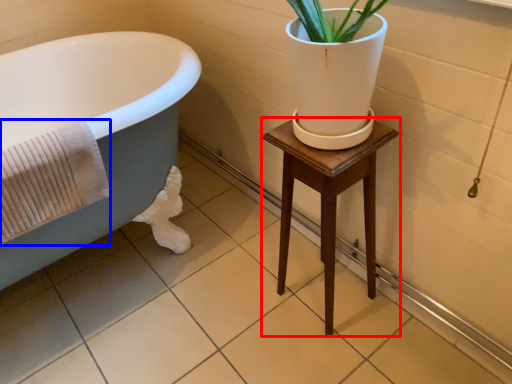
Question: Which object is closer to the camera taking this photo, furniture (highlighted by a red box) or bath towel (highlighted by a blue box)?

Choices:
 (A) furniture
 (B) bath towel

Answer: (B)